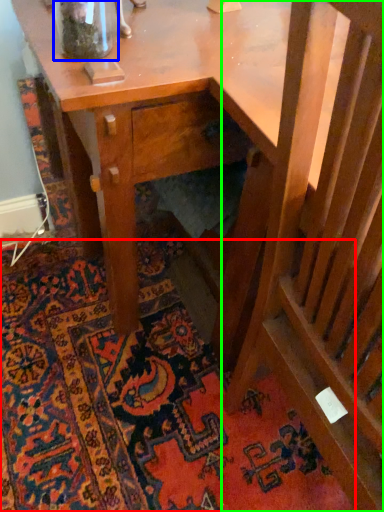
Question: Which object is the farthest from mat (highlighted by a red box)? Choose among these: glass vase (highlighted by a blue box) or rocking chair (highlighted by a green box).

Choices:
 (A) glass vase
 (B) rocking chair

Answer: (A)